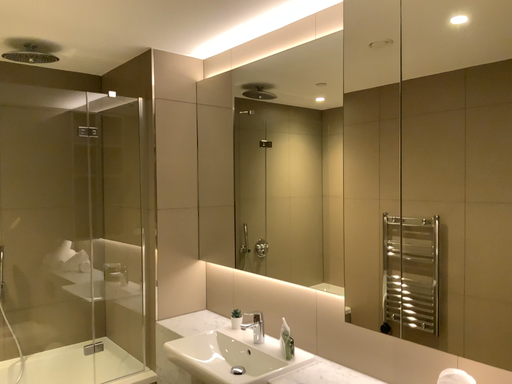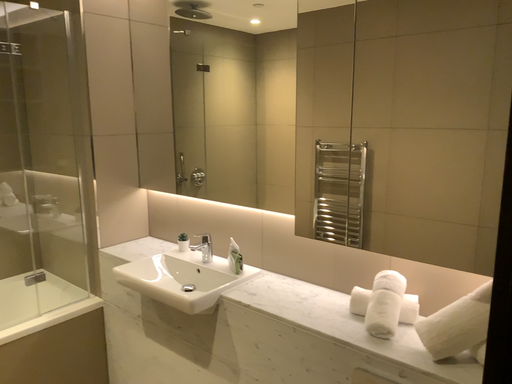
Question: How did the camera likely rotate when shooting the video?

Choices:
 (A) rotated upward
 (B) rotated downward

Answer: (B)